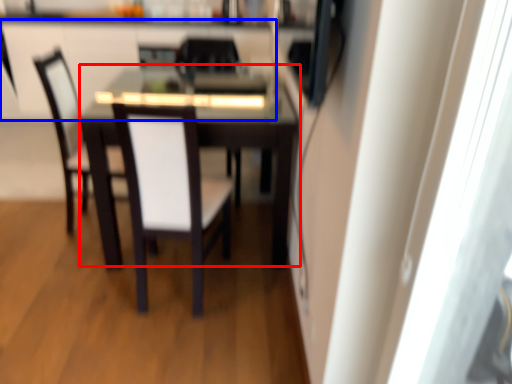
Question: Which of the following is the farthest to the observer, table (highlighted by a red box) or cabinetry (highlighted by a blue box)?

Choices:
 (A) table
 (B) cabinetry

Answer: (B)